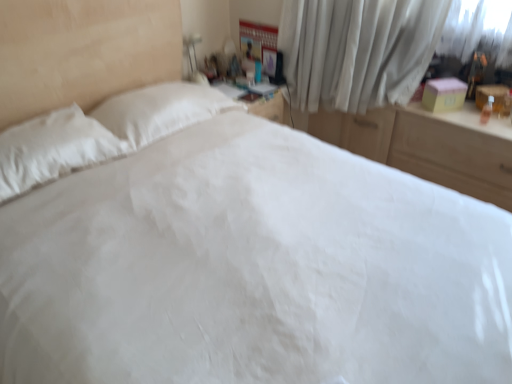
Question: Considering the relative sizes of wooden dresser at right and white sheer curtain at upper right in the image provided, is wooden dresser at right shorter than white sheer curtain at upper right?

Choices:
 (A) yes
 (B) no

Answer: (A)

Question: Considering the relative sizes of wooden dresser at right and white sheer curtain at upper right in the image provided, is wooden dresser at right thinner than white sheer curtain at upper right?

Choices:
 (A) no
 (B) yes

Answer: (A)

Question: Is wooden dresser at right bigger than white sheer curtain at upper right?

Choices:
 (A) no
 (B) yes

Answer: (B)

Question: Is the position of wooden dresser at right more distant than that of white sheer curtain at upper right?

Choices:
 (A) yes
 (B) no

Answer: (B)

Question: Can you confirm if wooden dresser at right is positioned to the right of white sheer curtain at upper right?

Choices:
 (A) yes
 (B) no

Answer: (A)

Question: From the image's perspective, is wooden dresser at right beneath white sheer curtain at upper right?

Choices:
 (A) yes
 (B) no

Answer: (A)

Question: Does white sheer curtain at upper right have a larger size compared to wooden dresser at right?

Choices:
 (A) no
 (B) yes

Answer: (A)

Question: Considering the relative positions of white sheer curtain at upper right and wooden dresser at right in the image provided, is white sheer curtain at upper right behind wooden dresser at right?

Choices:
 (A) yes
 (B) no

Answer: (A)

Question: Could you tell me if white sheer curtain at upper right is facing wooden dresser at right?

Choices:
 (A) no
 (B) yes

Answer: (A)

Question: Considering the relative sizes of white sheer curtain at upper right and wooden dresser at right in the image provided, is white sheer curtain at upper right shorter than wooden dresser at right?

Choices:
 (A) yes
 (B) no

Answer: (B)

Question: Would you consider white sheer curtain at upper right to be distant from wooden dresser at right?

Choices:
 (A) yes
 (B) no

Answer: (B)

Question: Is white sheer curtain at upper right at the right side of wooden dresser at right?

Choices:
 (A) no
 (B) yes

Answer: (A)

Question: In the image, is wooden dresser at right positioned in front of or behind white sheer curtain at upper right?

Choices:
 (A) behind
 (B) front

Answer: (B)